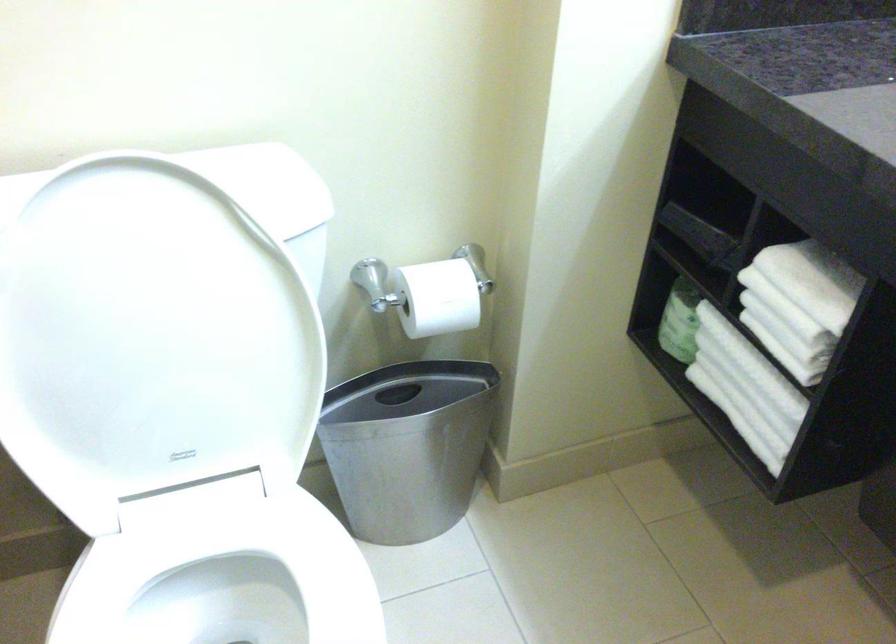
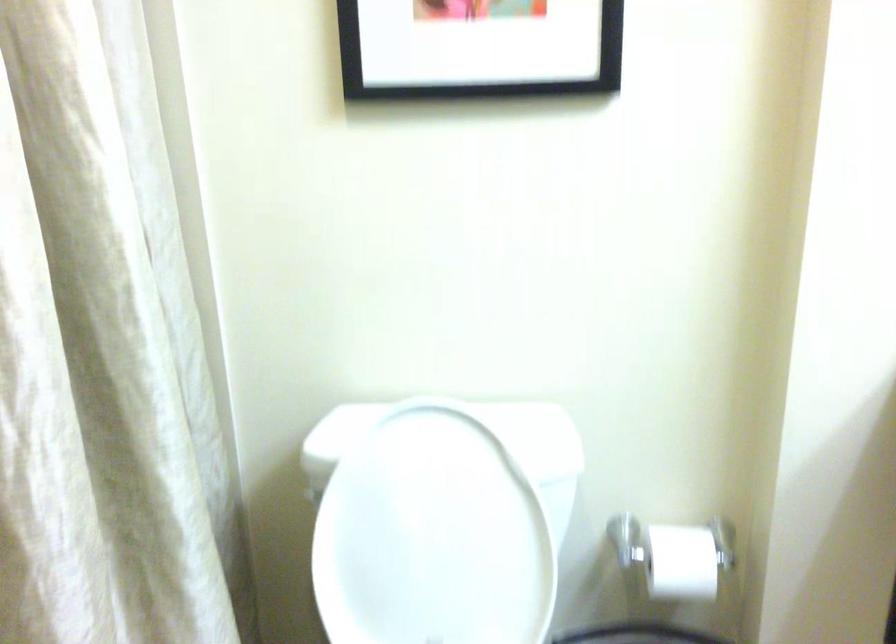
Find the pixel in the second image that matches (x=168, y=310) in the first image.

(440, 520)